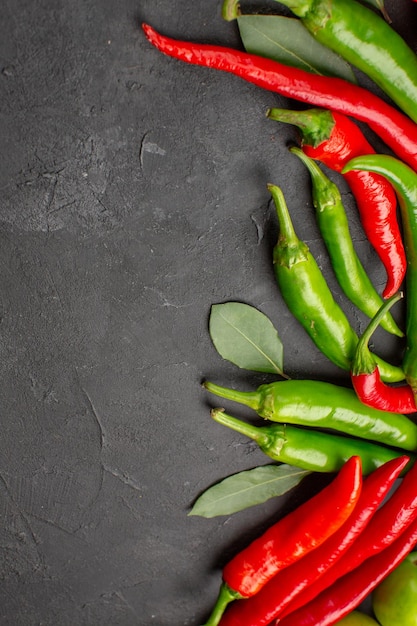
Locate an element on the screen. This screenshot has height=626, width=417. white spots in table is located at coordinates (86, 173), (164, 304).